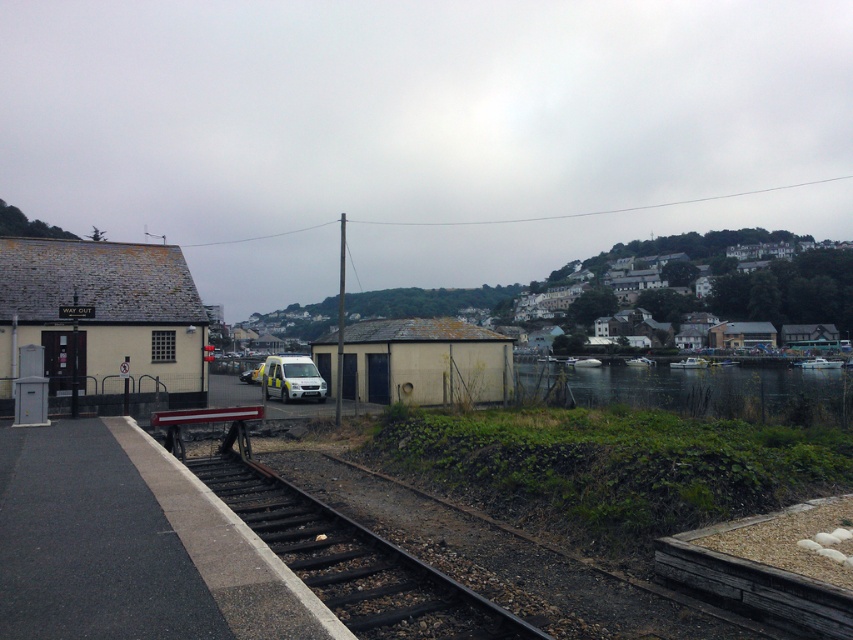
You are standing at the center of the railway tracks in the image. Which direction should you walk to reach the matte yellow building at left?

Since the matte yellow building at left is located at point [102,320], you should walk towards the left side of the tracks to reach it.

You are a maintenance worker standing at the camera position. You need to inspect the black metal train track at lower center. Can you reach it without moving more than 6 meters?

The black metal train track at lower center and camera are 5.88 meters apart from each other, so yes, you can reach it without moving more than 6 meters.

You are a pedestrian standing on the platform at the railway station. You see the green water at lower right and the white matte ambulance at center. How far apart are these two objects from each other?

The green water at lower right and the white matte ambulance at center are 186.95 feet apart from each other.